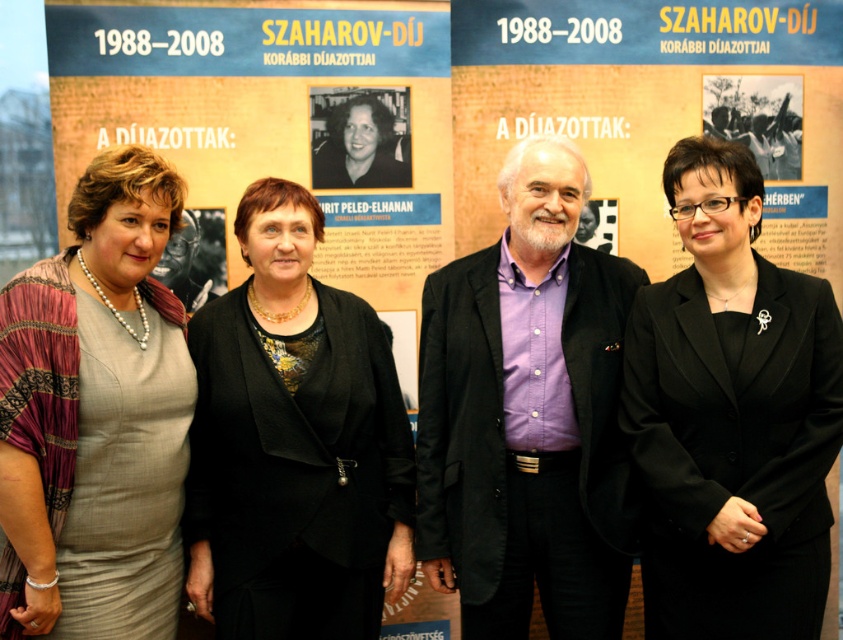
Does point (659, 298) lie behind point (31, 600)?

Yes, it is behind point (31, 600).

Does black glossy blazer at center lie in front of matte gray dress at center left?

No, it is not.

Which is in front, point (752, 301) or point (125, 355)?

Point (125, 355) is in front.

Identify the location of black glossy blazer at center. (731, 417).

Is black glossy blazer at center shorter than black textured blazer at center?

No, black glossy blazer at center is not shorter than black textured blazer at center.

Which is behind, point (760, 465) or point (395, 486)?

The point (395, 486) is behind.

The image size is (843, 640). I want to click on black glossy blazer at center, so point(731,417).

Which of these two, purple cotton shirt at center or black glossy blazer at center, stands taller?

Standing taller between the two is purple cotton shirt at center.

Is purple cotton shirt at center positioned in front of black glossy blazer at center?

No, it is behind black glossy blazer at center.

Who is more distant from viewer, (559, 401) or (813, 557)?

Positioned behind is point (559, 401).

Identify the location of purple cotton shirt at center. This screenshot has width=843, height=640. (527, 416).